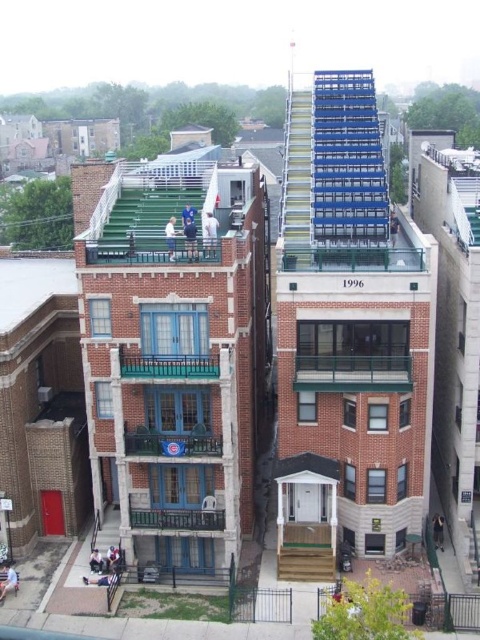
You are standing in front of the building and notice two balconies at the center. Which balcony, the green glass balcony at center or the blue painted wood balcony at center, is nearer to you?

The green glass balcony at center is closer to the viewer than the blue painted wood balcony at center, so the green glass balcony at center is nearer to you.

From the picture: You are a delivery person trying to place a large package on the balcony. The package requires a space of at least 2 meters in length. Given the green glass balcony at center and the blue painted wood balcony at center, which one can accommodate the package?

The green glass balcony at center has a larger size compared to the blue painted wood balcony at center, so it can accommodate the package requiring at least 2 meters in length.

You are standing on the green painted wood balcony at lower center and want to move to the teal wrought iron balcony at center. Which direction should you move to reach it?

The teal wrought iron balcony at center is located above the green painted wood balcony at lower center, so you should move upward to reach it.